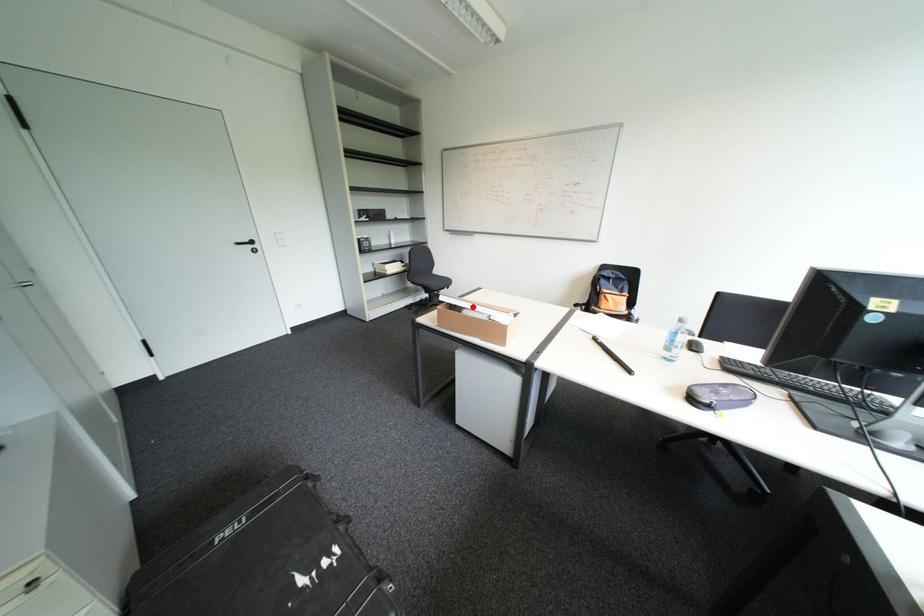
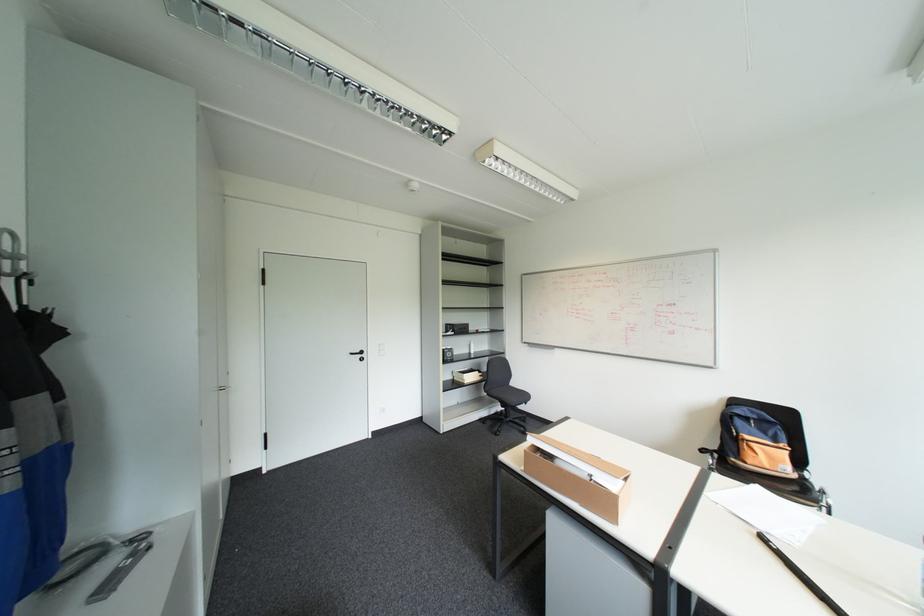
Question: A red point is marked in image1. In image2, is the corresponding 3D point closer to the camera or farther? Reply with the corresponding letter.

Choices:
 (A) The corresponding 3D point is closer.
 (B) The corresponding 3D point is farther.

Answer: (A)